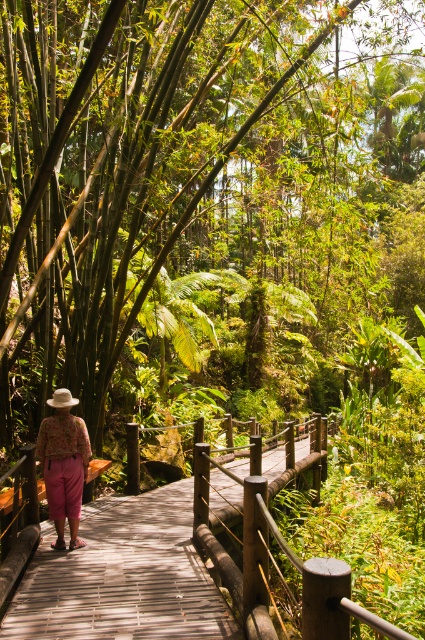
Who is shorter, wooden bridge at center or floral fabric pants at center?

With less height is wooden bridge at center.

The image size is (425, 640). In order to click on wooden bridge at center in this screenshot , I will do `click(127, 579)`.

Does point (170, 586) come farther from viewer compared to point (39, 429)?

That is False.

The image size is (425, 640). Find the location of `wooden bridge at center`. wooden bridge at center is located at coordinates (127, 579).